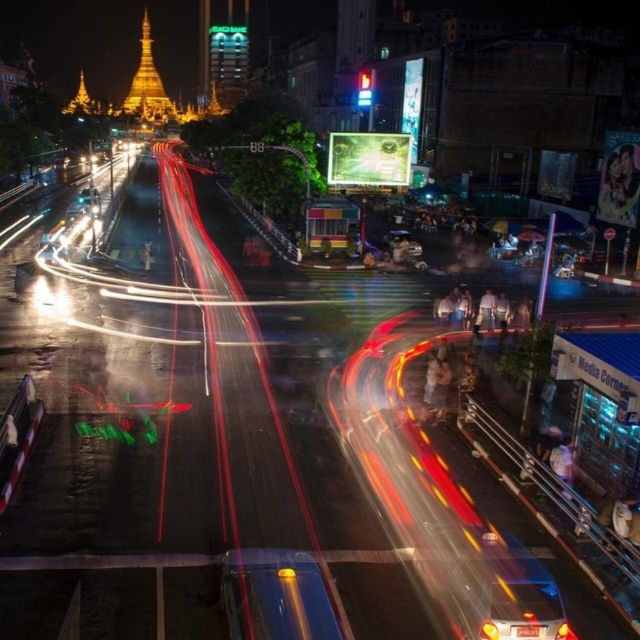
Does metallic blue car at lower right have a larger size compared to yellow glass light at center?

Yes.

Between metallic blue car at lower right and yellow glass light at center, which one appears on the left side from the viewer's perspective?

From the viewer's perspective, yellow glass light at center appears more on the left side.

I want to click on metallic blue car at lower right, so click(496, 588).

The image size is (640, 640). Identify the location of metallic blue car at lower right. (496, 588).

Does metallic blue car at lower right appear on the left side of shiny blue car at center?

In fact, metallic blue car at lower right is to the right of shiny blue car at center.

Can you confirm if metallic blue car at lower right is shorter than shiny blue car at center?

No.

Is point (508, 600) behind point (268, 611)?

Yes, it is behind point (268, 611).

Find the location of `metallic blue car at lower right`. metallic blue car at lower right is located at coordinates pos(496,588).

In the scene shown: Who is positioned more to the right, shiny blue car at center or yellow glass light at center?

yellow glass light at center

Is shiny blue car at center to the left of yellow glass light at center from the viewer's perspective?

Yes, shiny blue car at center is to the left of yellow glass light at center.

I want to click on shiny blue car at center, so click(275, 596).